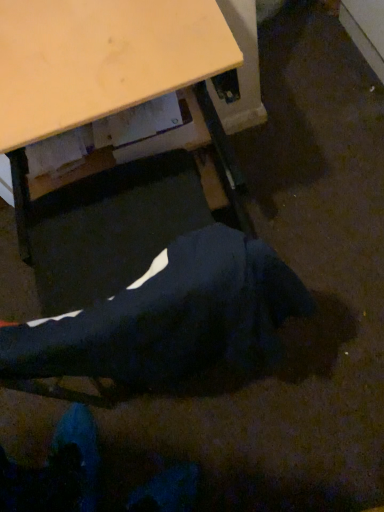
Find the location of a particular element. The height and width of the screenshot is (512, 384). vacant space situated above wooden desk at center (from a real-world perspective) is located at coordinates (73, 38).